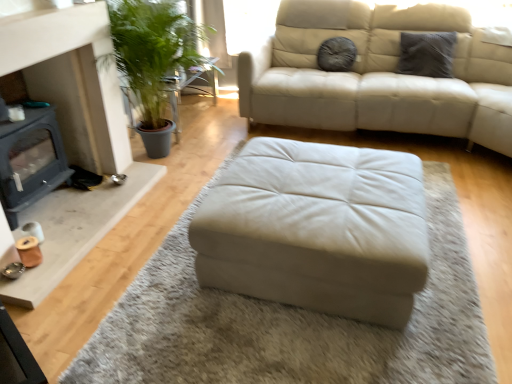
The width and height of the screenshot is (512, 384). What do you see at coordinates (30, 161) in the screenshot?
I see `matte gray fireplace at lower left` at bounding box center [30, 161].

In order to face beige leather ottoman at center, should I rotate leftwards or rightwards?

To face it directly, rotate right by 8.014 degrees.

What do you see at coordinates (336, 54) in the screenshot? Image resolution: width=512 pixels, height=384 pixels. I see `fuzzy gray pillow at upper center, which is the 1th pillow from left to right` at bounding box center [336, 54].

What do you see at coordinates (189, 87) in the screenshot? I see `green leafy plant at left` at bounding box center [189, 87].

What do you see at coordinates (426, 54) in the screenshot? I see `gray textured pillow at upper right, arranged as the 2th pillow when viewed from the left` at bounding box center [426, 54].

Describe the element at coordinates (290, 322) in the screenshot. I see `beige leather ottoman at center` at that location.

The height and width of the screenshot is (384, 512). I want to click on matte gray fireplace at lower left, so click(30, 161).

Locate an element on the screen. The image size is (512, 384). stool on the right of green leafy plant at left is located at coordinates (317, 229).

How much distance is there between beige leather ottoman at center and green leafy plant at left?

beige leather ottoman at center and green leafy plant at left are 8.67 feet apart.

Considering the relative positions of beige leather ottoman at center and green leafy plant at left in the image provided, is beige leather ottoman at center behind green leafy plant at left?

No, beige leather ottoman at center is in front of green leafy plant at left.

Which is less distant, (415, 232) or (170, 80)?

Positioned in front is point (415, 232).

From a real-world perspective, who is located lower, matte gray fireplace at lower left or green leafy plant at left?

From a 3D spatial view, green leafy plant at left is below.

The image size is (512, 384). I want to click on table that is above the matte gray fireplace at lower left (from the image's perspective), so click(189, 87).

Is matte gray fireplace at lower left next to green leafy plant at left?

No, matte gray fireplace at lower left is not beside green leafy plant at left.

Is matte gray fireplace at lower left aimed at green leafy plant at left?

No, matte gray fireplace at lower left does not turn towards green leafy plant at left.

Between fuzzy gray pillow at upper center, which is counted as the second pillow, starting from the right, and green leafy plant at left, which one has less height?

fuzzy gray pillow at upper center, which is counted as the second pillow, starting from the right, is shorter.

Is the position of fuzzy gray pillow at upper center, which is counted as the second pillow, starting from the right, more distant than that of green leafy plant at left?

Yes, fuzzy gray pillow at upper center, which is counted as the second pillow, starting from the right, is further from the viewer.

Can you confirm if fuzzy gray pillow at upper center, which is the 1th pillow from left to right, is thinner than green leafy plant at left?

Correct, the width of fuzzy gray pillow at upper center, which is the 1th pillow from left to right, is less than that of green leafy plant at left.

Who is bigger, fuzzy gray pillow at upper center, which is the 1th pillow from left to right, or green leafy plant at left?

green leafy plant at left is bigger.

Is the position of beige leather ottoman at center less distant than that of matte gray fireplace at lower left?

That is True.

Which of these two, beige leather ottoman at center or matte gray fireplace at lower left, is smaller?

matte gray fireplace at lower left is smaller.

From a real-world perspective, is beige leather ottoman at center positioned over matte gray fireplace at lower left based on gravity?

No.

Is there a large distance between beige leather ottoman at center and matte gray fireplace at lower left?

Yes, beige leather ottoman at center is far from matte gray fireplace at lower left.

Considering the sizes of green leafy plant at left and fuzzy gray pillow at upper center, which is the 1th pillow from left to right, in the image, is green leafy plant at left bigger or smaller than fuzzy gray pillow at upper center, which is the 1th pillow from left to right,?

Clearly, green leafy plant at left is larger in size than fuzzy gray pillow at upper center, which is the 1th pillow from left to right.

Does green leafy plant at left have a greater width compared to fuzzy gray pillow at upper center, which is the 1th pillow from left to right?

Yes.

Is green leafy plant at left closer to the viewer compared to fuzzy gray pillow at upper center, which is counted as the second pillow, starting from the right?

Yes, green leafy plant at left is in front of fuzzy gray pillow at upper center, which is counted as the second pillow, starting from the right.

Is gray textured pillow at upper right, arranged as the 2th pillow when viewed from the left, in front of or behind green leafy plant at left in the image?

In the image, gray textured pillow at upper right, arranged as the 2th pillow when viewed from the left, appears in front of green leafy plant at left.

Who is smaller, gray textured pillow at upper right, arranged as the 2th pillow when viewed from the left, or green leafy plant at left?

Smaller between the two is gray textured pillow at upper right, arranged as the 2th pillow when viewed from the left.

Which pillow is the 2nd one when counting from the right side of the green leafy plant at left? Please provide its 2D coordinates.

[(426, 54)]

From the picture: Measure the distance between gray textured pillow at upper right, acting as the first pillow starting from the right, and green leafy plant at left.

gray textured pillow at upper right, acting as the first pillow starting from the right, is 6.46 feet away from green leafy plant at left.

Are gray textured pillow at upper right, acting as the first pillow starting from the right, and beige leather ottoman at center making contact?

No, gray textured pillow at upper right, acting as the first pillow starting from the right, is not with beige leather ottoman at center.

Based on the photo, does gray textured pillow at upper right, acting as the first pillow starting from the right, come behind beige leather ottoman at center?

That is True.

Is gray textured pillow at upper right, arranged as the 2th pillow when viewed from the left, thinner than beige leather ottoman at center?

Yes, gray textured pillow at upper right, arranged as the 2th pillow when viewed from the left, is thinner than beige leather ottoman at center.

You are a GUI agent. You are given a task and a screenshot of the screen. Output one action in this format:
    pyautogui.click(x=<x>, y=<y>)
    Task: Click on the stool located in front of the green leafy plant at left
    The width and height of the screenshot is (512, 384).
    Given the screenshot: What is the action you would take?
    pyautogui.click(x=317, y=229)

You are a GUI agent. You are given a task and a screenshot of the screen. Output one action in this format:
    pyautogui.click(x=<x>, y=<y>)
    Task: Click on the fireplace below the green leafy plant at left (from the image's perspective)
    Image resolution: width=512 pixels, height=384 pixels.
    Given the screenshot: What is the action you would take?
    pyautogui.click(x=30, y=161)

From the image, which object appears to be farther from gray textured pillow at upper right, arranged as the 2th pillow when viewed from the left, green leafy plant at left or beige leather ottoman at center?

Based on the image, beige leather ottoman at center appears to be further to gray textured pillow at upper right, arranged as the 2th pillow when viewed from the left.

When comparing their distances from fuzzy gray pillow at upper center, which is counted as the second pillow, starting from the right, does green leafy plant at left or beige leather ottoman at center seem closer?

Based on the image, green leafy plant at left appears to be nearer to fuzzy gray pillow at upper center, which is counted as the second pillow, starting from the right.

Which object lies further to the anchor point green leafy plant at left, matte gray fireplace at lower left or gray textured pillow at upper right, arranged as the 2th pillow when viewed from the left?

matte gray fireplace at lower left lies further to green leafy plant at left than the other object.

Based on their spatial positions, is beige leather ottoman at center or gray textured pillow at upper right, arranged as the 2th pillow when viewed from the left, closer to beige leather ottoman at center?

Based on the image, beige leather ottoman at center appears to be nearer to beige leather ottoman at center.

Consider the image. From the image, which object appears to be farther from beige leather ottoman at center, fuzzy gray pillow at upper center, which is counted as the second pillow, starting from the right, or matte gray fireplace at lower left?

fuzzy gray pillow at upper center, which is counted as the second pillow, starting from the right, lies further to beige leather ottoman at center than the other object.

Based on their spatial positions, is beige leather ottoman at center or beige leather ottoman at center further from fuzzy gray pillow at upper center, which is the 1th pillow from left to right?

beige leather ottoman at center is further to fuzzy gray pillow at upper center, which is the 1th pillow from left to right.

From the image, which object appears to be farther from fuzzy gray pillow at upper center, which is counted as the second pillow, starting from the right, beige leather ottoman at center or gray textured pillow at upper right, acting as the first pillow starting from the right?

beige leather ottoman at center.

From the image, which object appears to be farther from beige leather ottoman at center, beige leather ottoman at center or fuzzy gray pillow at upper center, which is counted as the second pillow, starting from the right?

fuzzy gray pillow at upper center, which is counted as the second pillow, starting from the right, lies further to beige leather ottoman at center than the other object.

The width and height of the screenshot is (512, 384). Identify the location of stool between matte gray fireplace at lower left and beige leather ottoman at center in the horizontal direction. (317, 229).

At what (x,y) coordinates should I click in order to perform the action: click on mat situated between matte gray fireplace at lower left and fuzzy gray pillow at upper center, which is counted as the second pillow, starting from the right, from left to right. Please return your answer as a coordinate pair (x, y). This screenshot has height=384, width=512. Looking at the image, I should click on [290, 322].

The image size is (512, 384). Identify the location of table between beige leather ottoman at center and fuzzy gray pillow at upper center, which is counted as the second pillow, starting from the right, in the front-back direction. (189, 87).

Locate an element on the screen. pillow between matte gray fireplace at lower left and gray textured pillow at upper right, acting as the first pillow starting from the right, from left to right is located at coordinates (336, 54).